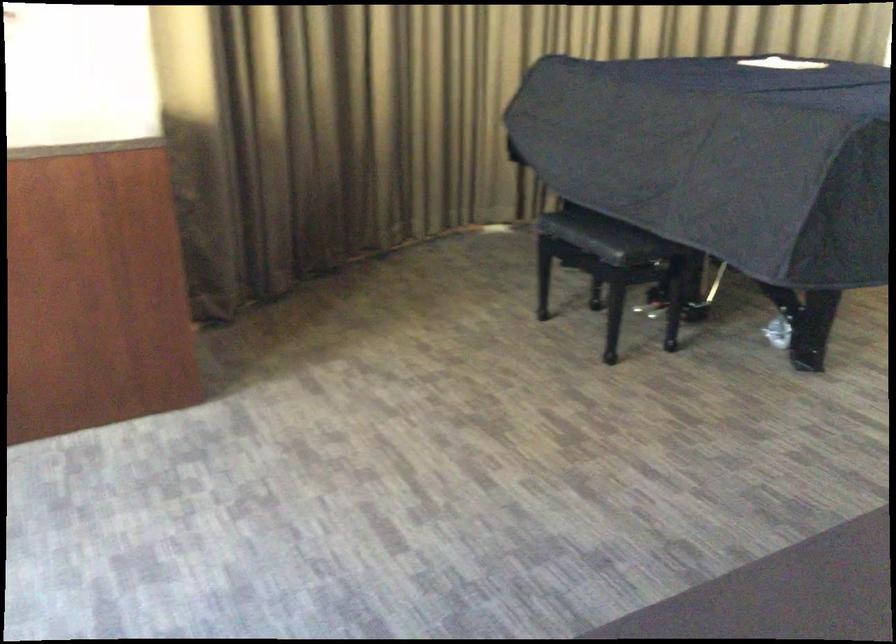
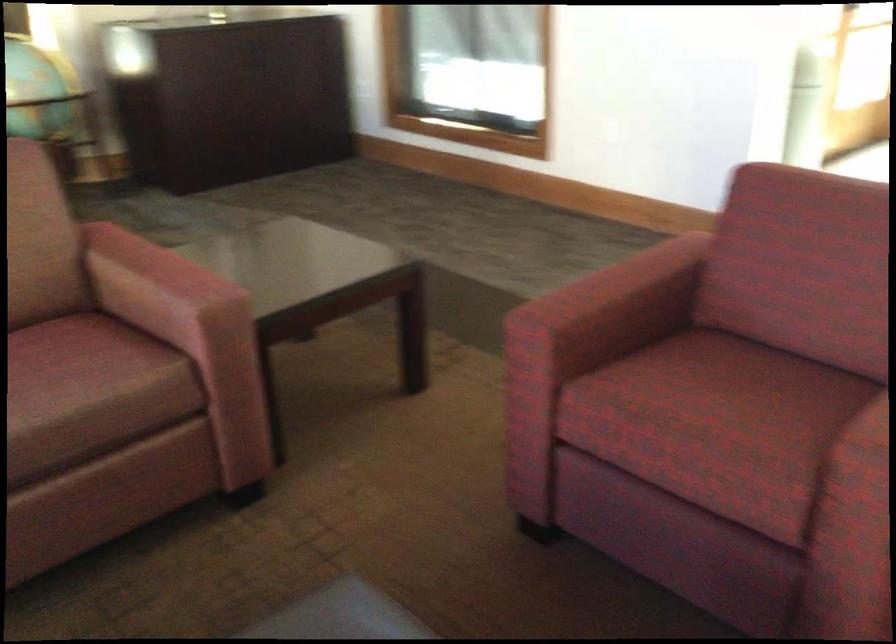
Question: Which direction would the cameraman need to move to produce the second image? Reply with the corresponding letter.

Choices:
 (A) Left
 (B) Right
 (C) Forward
 (D) Backward

Answer: (B)